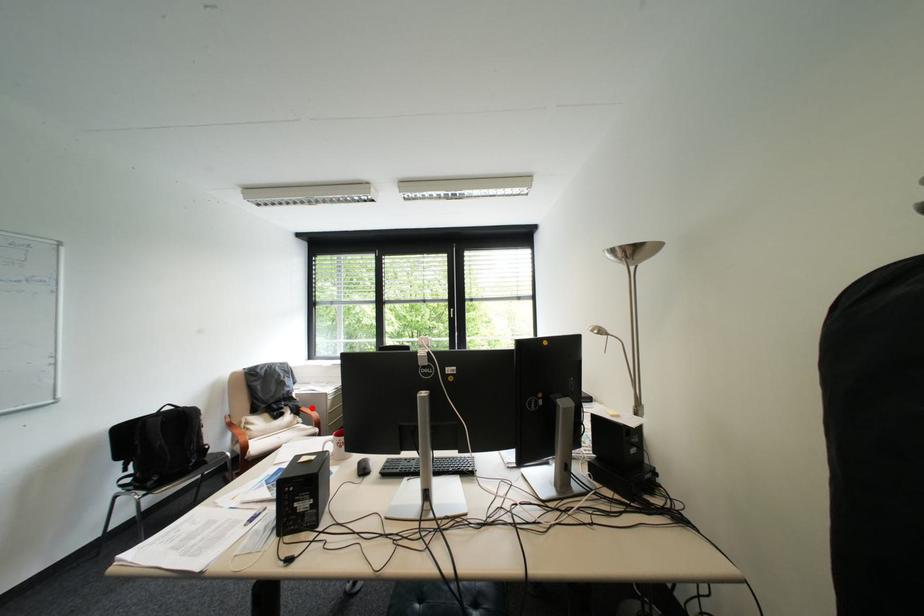
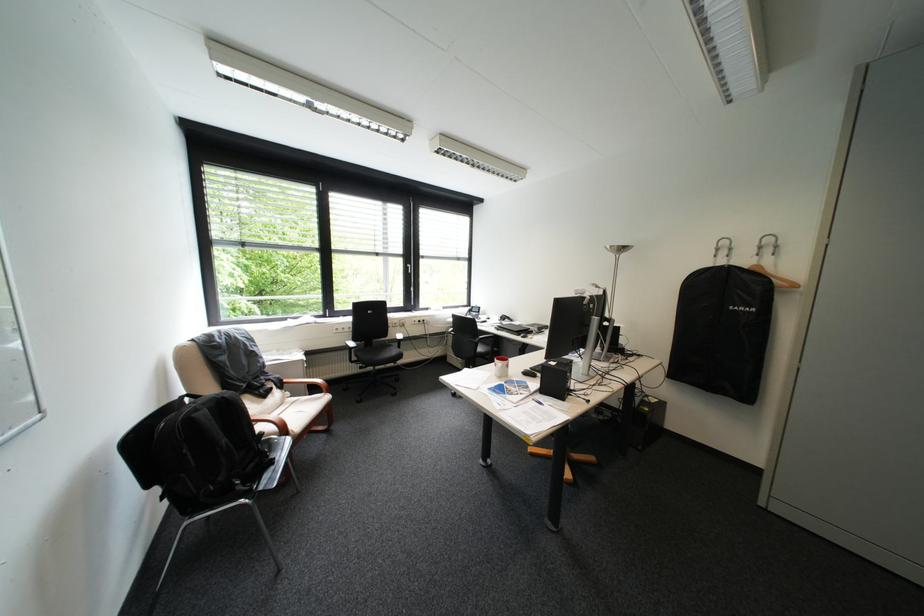
Question: I am providing you with two images of the same scene from different viewpoints. In image1, a red point is highlighted. Considering the same 3D point in image2, which of the following is correct?

Choices:
 (A) It is closer
 (B) It is farther

Answer: (A)